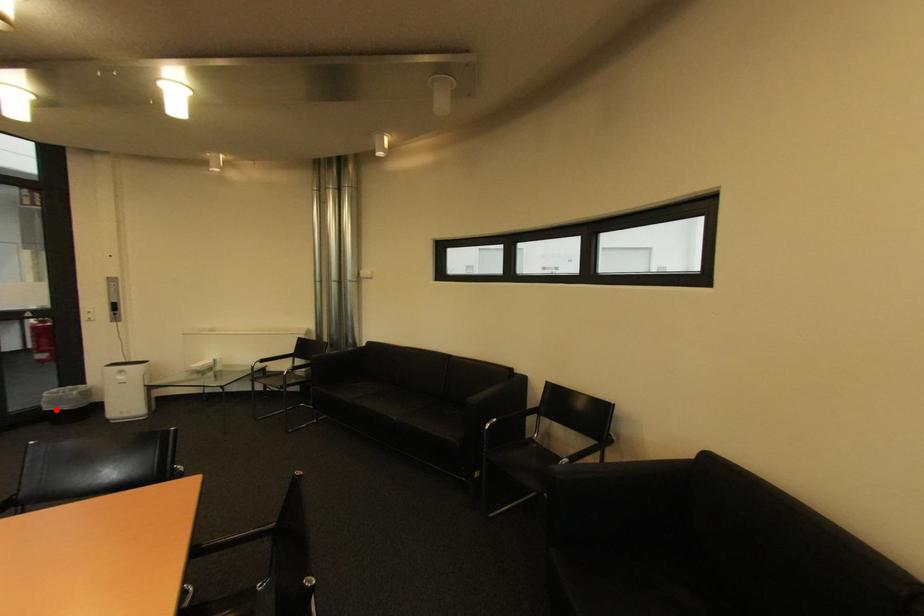
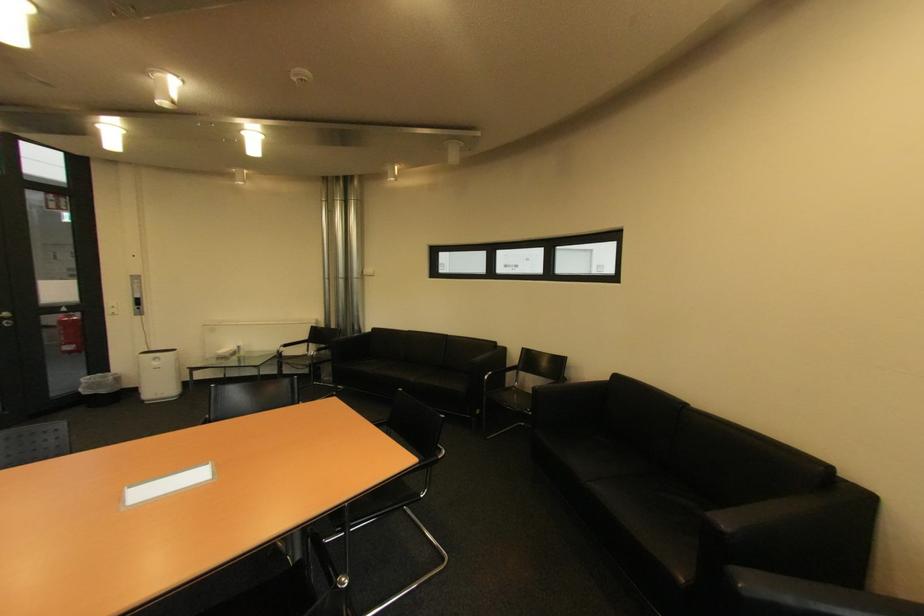
Question: I am providing you with two images of the same scene from different viewpoints. A red point is marked on the first image. At the location where the point appears in image 1, is it still visible in image 2?

Choices:
 (A) Yes
 (B) No

Answer: (A)